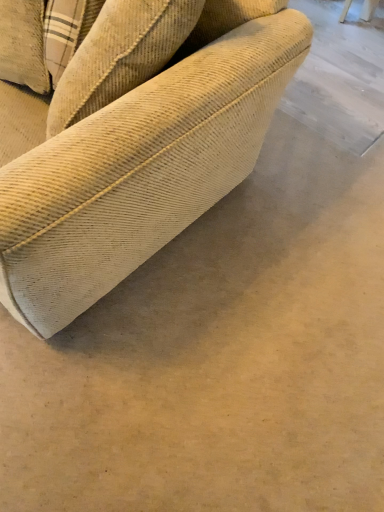
At what (x,y) coordinates should I click in order to perform the action: click on beige corduroy couch at lower left. Please return your answer as a coordinate pair (x, y). Looking at the image, I should click on (133, 143).

Describe the element at coordinates (133, 143) in the screenshot. I see `beige corduroy couch at lower left` at that location.

Find the location of a particular element. beige corduroy couch at lower left is located at coordinates (133, 143).